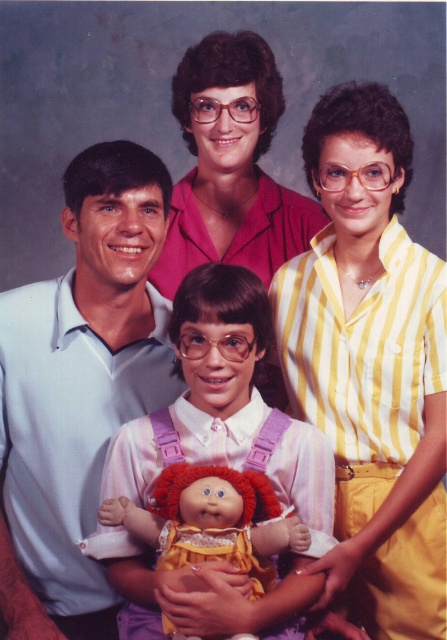
In the family portrait, you notice the yellow striped shirt at upper right and the light blue cotton shirt at left. Which one appears bigger in size?

The yellow striped shirt at upper right is larger in size compared to the light blue cotton shirt at left.

You are a photographer setting up for a family portrait. You need to ensure that the yellow striped shirt at upper right and the plush fabric doll at center are positioned so that they are at least 12 inches apart. Based on the image provided, is this requirement met?

The distance between the yellow striped shirt at upper right and the plush fabric doll at center is 13.56 inches, which is more than the required 12 inches. Therefore, the requirement is met.